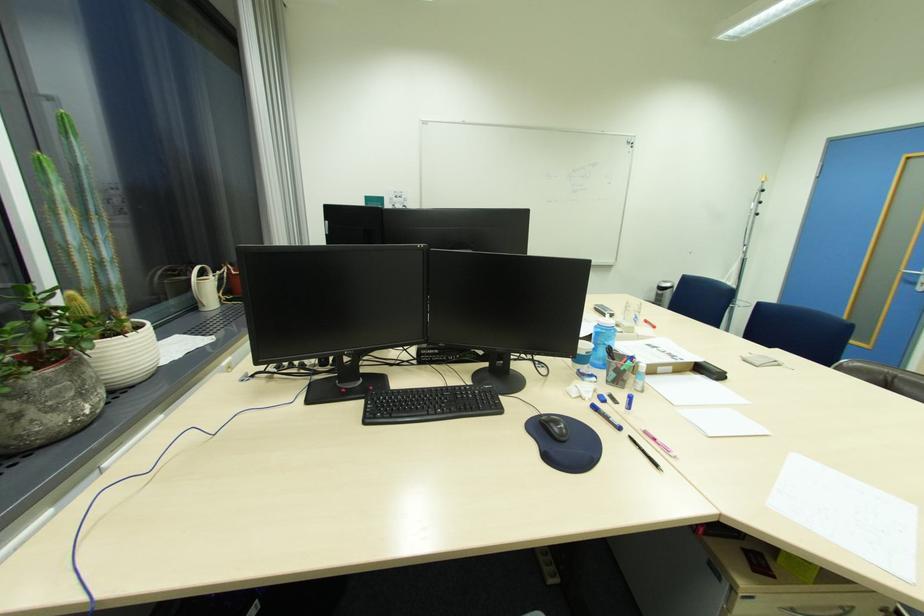
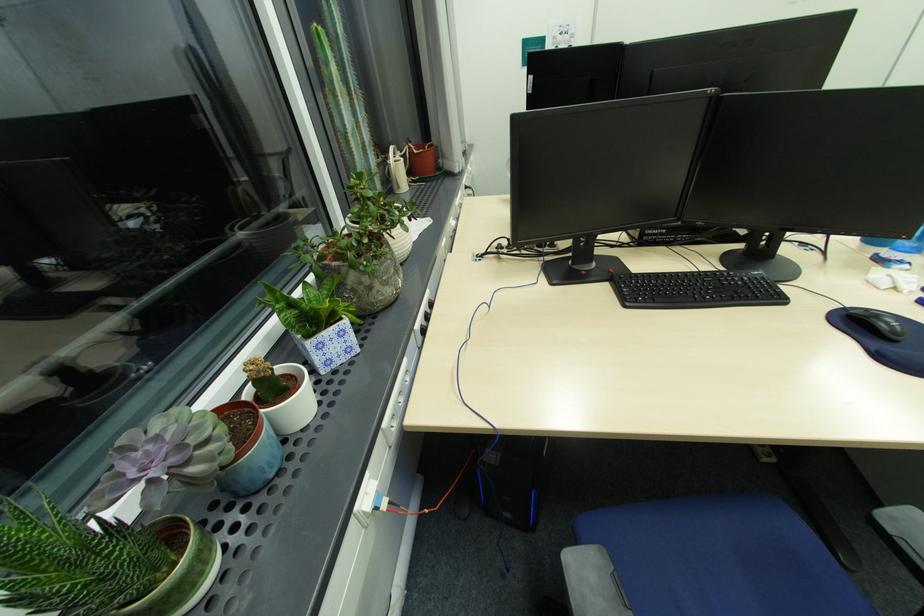
In the second image, find the point that corresponds to (209,306) in the first image.

(406, 188)